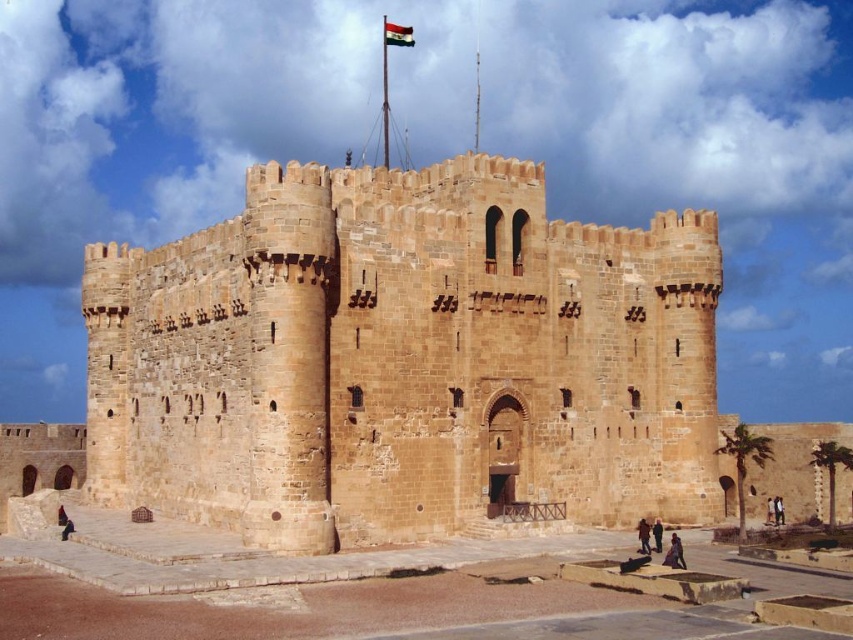
Question: Which of the following is the farthest from the observer?

Choices:
 (A) (387, 29)
 (B) (584, 275)

Answer: (A)

Question: Does brown stone fort at center have a greater width compared to polyester flag at upper center?

Choices:
 (A) no
 (B) yes

Answer: (B)

Question: Does brown stone fort at center have a lesser width compared to polyester flag at upper center?

Choices:
 (A) no
 (B) yes

Answer: (A)

Question: Which point is closer to the camera?

Choices:
 (A) polyester flag at upper center
 (B) brown stone fort at center

Answer: (B)

Question: Does brown stone fort at center appear on the right side of polyester flag at upper center?

Choices:
 (A) no
 (B) yes

Answer: (B)

Question: Which of the following is the farthest from the observer?

Choices:
 (A) (407, 42)
 (B) (451, 324)

Answer: (A)